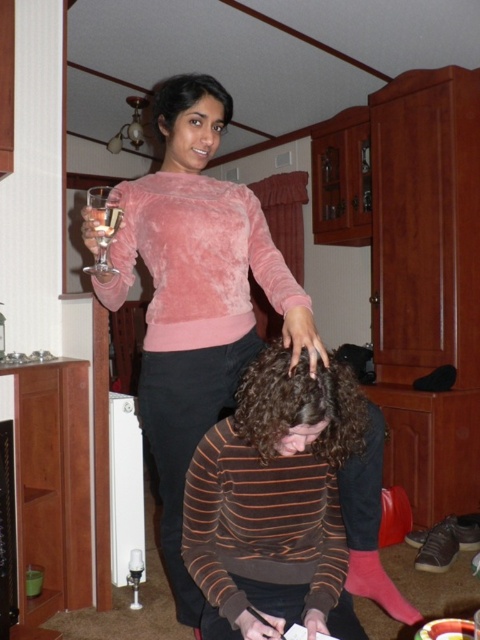
You are standing in the room and want to hand the clear glass wine glass at upper left to the person wearing the velvet pink sweater at upper center. Which direction should you move the glass to reach them?

The velvet pink sweater at upper center is to the right of the clear glass wine glass at upper left, so you should move the glass to the right to reach the person wearing the velvet pink sweater at upper center.

From the picture: You are standing in the room and want to place a small plant pot exactly at point (279, 289). If your arm reaches 1.5 meters, can you place it without moving closer?

The distance of point (279, 289) from camera is 1.52 meters, so your arm can only reach 1.5 meters. You need to move closer to reach the point (279, 289).